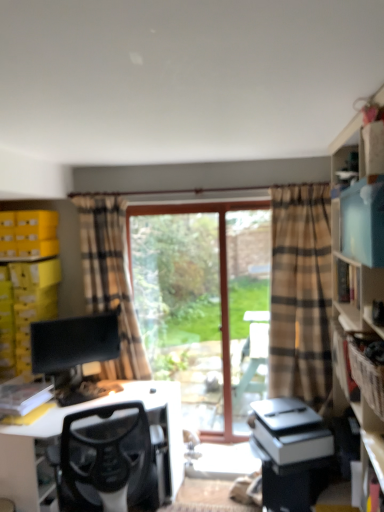
Question: From the image's perspective, is black mesh chair at lower left above or below yellow cardboard boxes at left, the 1th shelf viewed from the back?

Choices:
 (A) below
 (B) above

Answer: (A)

Question: From a real-world perspective, is black mesh chair at lower left physically located above or below yellow cardboard boxes at left, which appears as the 2th shelf when viewed from the right?

Choices:
 (A) below
 (B) above

Answer: (A)

Question: Estimate the real-world distances between objects in this image. Which object is farther from the white plastic printer at center?

Choices:
 (A) black mesh chair at lower left
 (B) matte black monitor at left
 (C) yellow cardboard boxes at left, the second shelf viewed from the front
 (D) wooden screen door at center
 (E) beige plaid curtain at left

Answer: (C)

Question: Which object is the farthest from the brown cardboard crate at right?

Choices:
 (A) wooden screen door at center
 (B) clear glass window at center
 (C) white plastic printer at center
 (D) beige plaid curtain at left
 (E) yellow cardboard boxes at left, which ranks as the 1th shelf in left-to-right order

Answer: (E)